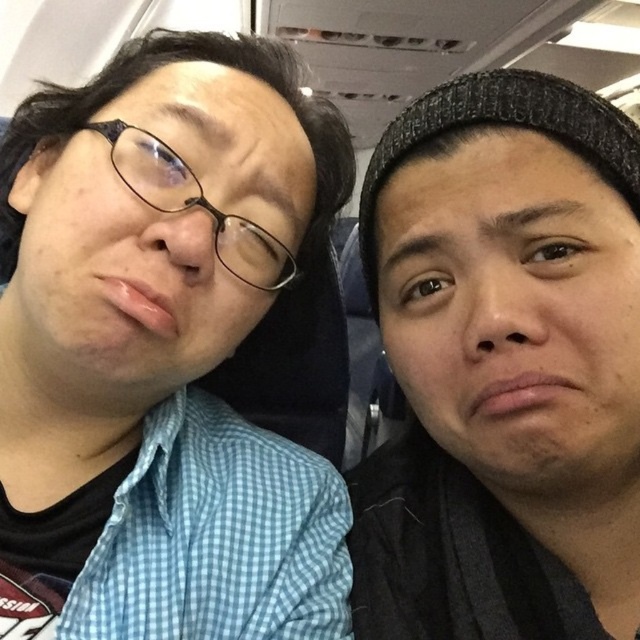
From the picture: Does blue checkered shirt at left have a lesser width compared to black knit cap at upper right?

No.

Find the location of a particular element. Image resolution: width=640 pixels, height=640 pixels. blue checkered shirt at left is located at coordinates (157, 355).

Identify the location of blue checkered shirt at left. This screenshot has width=640, height=640. (157, 355).